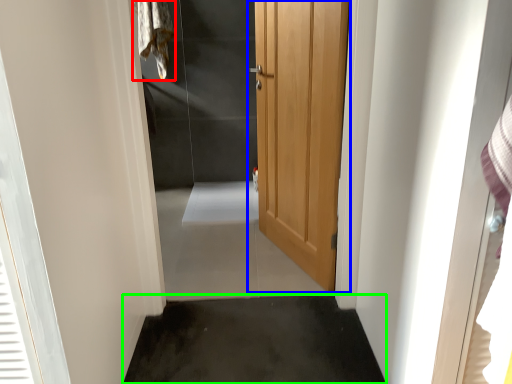
Question: Which object is the farthest from laundry (highlighted by a red box)? Choose among these: door (highlighted by a blue box) or concrete (highlighted by a green box).

Choices:
 (A) door
 (B) concrete

Answer: (B)